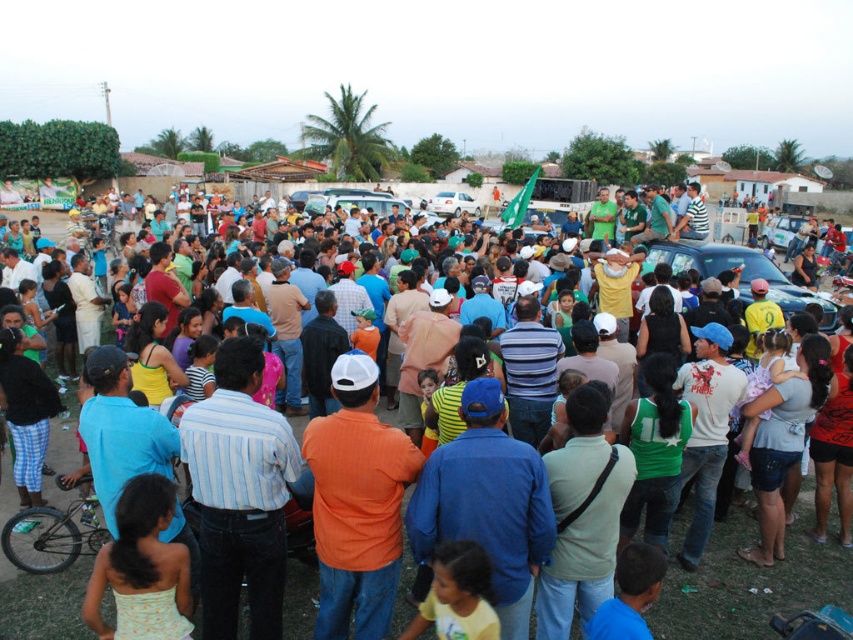
Question: Does matte blue shirt at center lie behind metallic blue car at center?

Choices:
 (A) no
 (B) yes

Answer: (A)

Question: Which of the following is the farthest from the observer?

Choices:
 (A) (744, 273)
 (B) (781, 588)

Answer: (A)

Question: Is the position of matte blue shirt at center more distant than that of metallic blue car at center?

Choices:
 (A) yes
 (B) no

Answer: (B)

Question: Considering the relative positions of matte blue shirt at center and metallic blue car at center in the image provided, where is matte blue shirt at center located with respect to metallic blue car at center?

Choices:
 (A) below
 (B) above

Answer: (A)